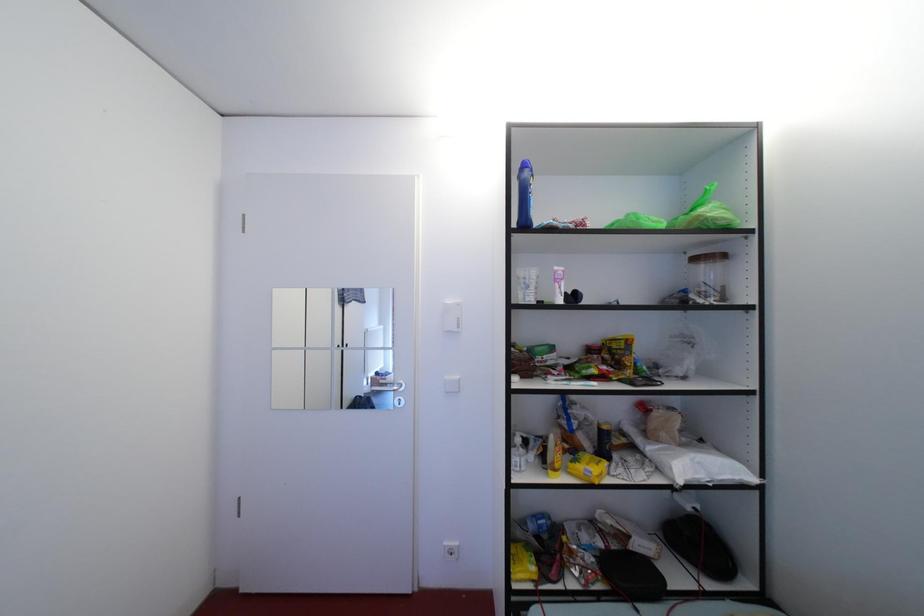
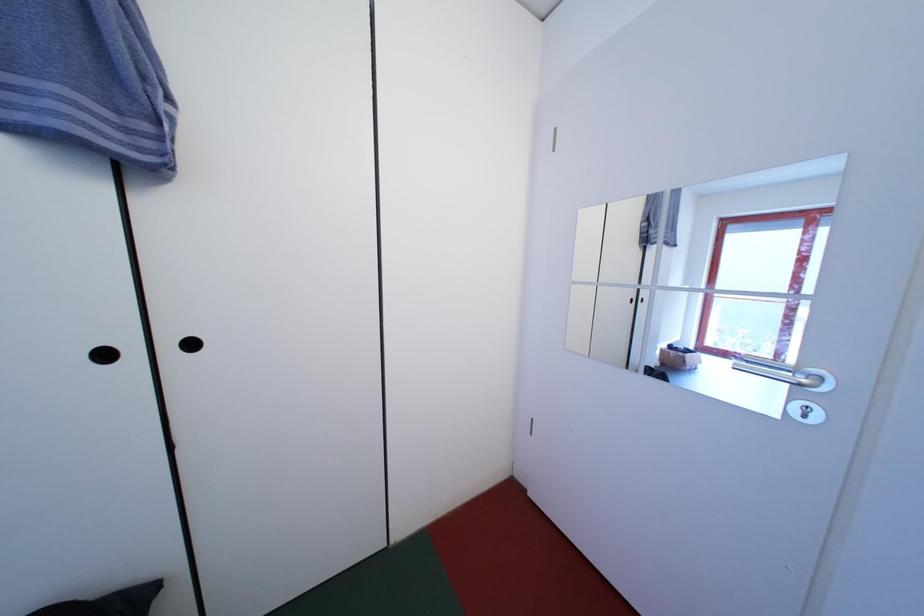
Question: The first image is from the beginning of the video and the second image is from the end. How did the camera likely rotate when shooting the video?

Choices:
 (A) Left
 (B) Right
 (C) Up
 (D) Down

Answer: (A)